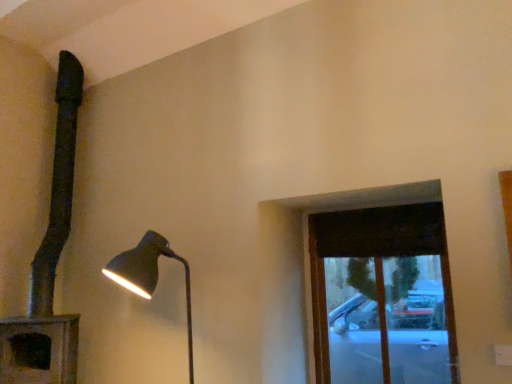
Question: Is matte black lamp at left, which is counted as the 1th lamp, starting from the left, at the right side of matte black lamp at left, marked as the 2th lamp in a left-to-right arrangement?

Choices:
 (A) no
 (B) yes

Answer: (A)

Question: Is matte black lamp at left, which is counted as the 2th lamp, starting from the right, bigger than matte black lamp at left, the first lamp in the right-to-left sequence?

Choices:
 (A) yes
 (B) no

Answer: (A)

Question: Is matte black lamp at left, which is counted as the 2th lamp, starting from the right, smaller than matte black lamp at left, marked as the 2th lamp in a left-to-right arrangement?

Choices:
 (A) no
 (B) yes

Answer: (A)

Question: From the image's perspective, is matte black lamp at left, which is counted as the 2th lamp, starting from the right, on top of matte black lamp at left, the first lamp in the right-to-left sequence?

Choices:
 (A) yes
 (B) no

Answer: (A)

Question: Is the depth of matte black lamp at left, which is counted as the 1th lamp, starting from the left, less than that of matte black lamp at left, the first lamp in the right-to-left sequence?

Choices:
 (A) no
 (B) yes

Answer: (A)

Question: From a real-world perspective, is matte black lamp at left, marked as the 2th lamp in a left-to-right arrangement, above or below matte black lamp at left, which is counted as the 2th lamp, starting from the right?

Choices:
 (A) below
 (B) above

Answer: (A)

Question: From the image's perspective, is matte black lamp at left, marked as the 2th lamp in a left-to-right arrangement, located above or below matte black lamp at left, which is counted as the 1th lamp, starting from the left?

Choices:
 (A) above
 (B) below

Answer: (B)

Question: Is matte black lamp at left, marked as the 2th lamp in a left-to-right arrangement, to the left or to the right of matte black lamp at left, which is counted as the 1th lamp, starting from the left, in the image?

Choices:
 (A) left
 (B) right

Answer: (B)

Question: Looking at the image, does matte black lamp at left, marked as the 2th lamp in a left-to-right arrangement, seem bigger or smaller compared to matte black lamp at left, which is counted as the 2th lamp, starting from the right?

Choices:
 (A) big
 (B) small

Answer: (B)

Question: Is dark wood window at upper right inside the boundaries of matte black lamp at left, the first lamp in the right-to-left sequence, or outside?

Choices:
 (A) inside
 (B) outside

Answer: (B)

Question: Considering the positions of point (433, 249) and point (112, 269), is point (433, 249) closer or farther from the camera than point (112, 269)?

Choices:
 (A) closer
 (B) farther

Answer: (B)

Question: Looking at the image, does dark wood window at upper right seem bigger or smaller compared to matte black lamp at left, the first lamp in the right-to-left sequence?

Choices:
 (A) small
 (B) big

Answer: (A)

Question: From a real-world perspective, relative to matte black lamp at left, marked as the 2th lamp in a left-to-right arrangement, is dark wood window at upper right vertically above or below?

Choices:
 (A) above
 (B) below

Answer: (A)

Question: Which is correct: dark wood window at upper right is inside matte black lamp at left, which is counted as the 1th lamp, starting from the left, or outside of it?

Choices:
 (A) inside
 (B) outside

Answer: (B)

Question: In the image, is dark wood window at upper right positioned in front of or behind matte black lamp at left, which is counted as the 2th lamp, starting from the right?

Choices:
 (A) behind
 (B) front

Answer: (B)